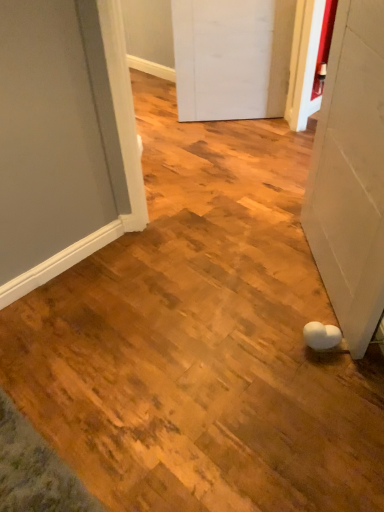
Identify the location of vacant location behind white matte door at lower right, the 1th door from the front. (267, 221).